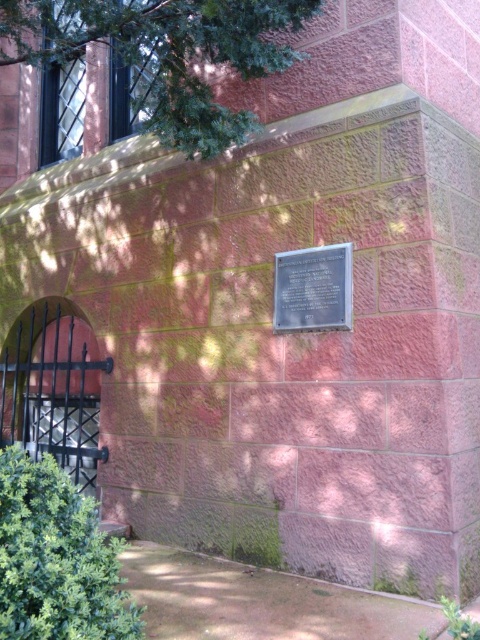
Question: Can you confirm if green leafy bush at lower left is positioned above metallic plaque at center?

Choices:
 (A) no
 (B) yes

Answer: (A)

Question: Is green leafy tree at upper left positioned before metallic plaque at center?

Choices:
 (A) no
 (B) yes

Answer: (B)

Question: Estimate the real-world distances between objects in this image. Which object is farther from the green leafy bush at lower left?

Choices:
 (A) metallic plaque at center
 (B) green leafy tree at upper left

Answer: (B)

Question: Among these points, which one is nearest to the camera?

Choices:
 (A) (55, 636)
 (B) (202, 115)

Answer: (A)

Question: Which is nearer to the green leafy bush at lower left?

Choices:
 (A) green leafy tree at upper left
 (B) metallic plaque at center

Answer: (B)

Question: Can you confirm if green leafy bush at lower left is smaller than metallic plaque at center?

Choices:
 (A) no
 (B) yes

Answer: (A)